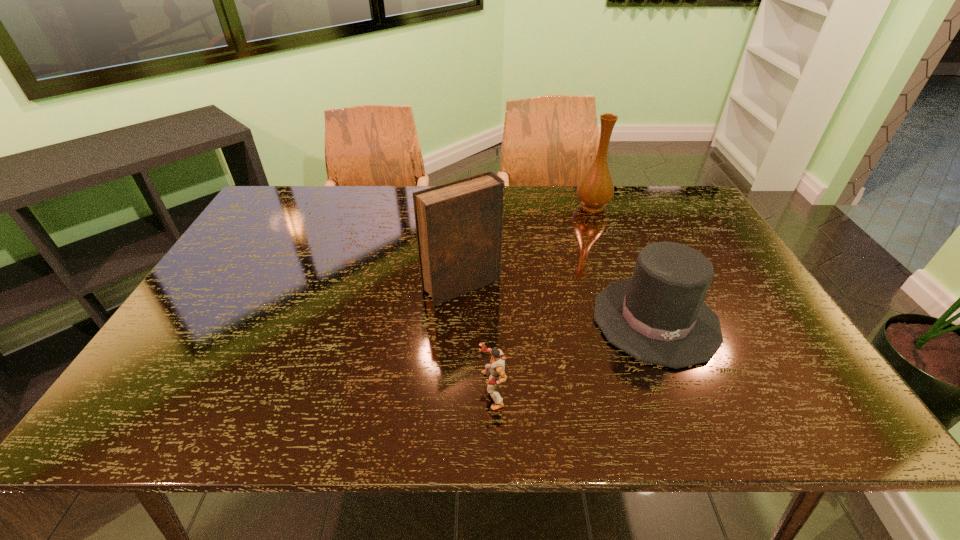
Where is `free space located 0.130m on the front-facing side of the puncher`? free space located 0.130m on the front-facing side of the puncher is located at coordinates (418, 390).

I want to click on object positioned at the far edge, so click(595, 190).

This screenshot has height=540, width=960. What are the coordinates of `object present at the near edge` in the screenshot? It's located at (495, 370).

Where is `object that is at the right edge`? This screenshot has height=540, width=960. object that is at the right edge is located at coordinates (658, 316).

This screenshot has height=540, width=960. In the image, there is a desktop. In order to click on vacant region at the far edge in this screenshot , I will do `click(542, 206)`.

I want to click on free space at the near edge of the desktop, so click(x=459, y=404).

Find the location of `free space at the right edge`. free space at the right edge is located at coordinates (697, 228).

The width and height of the screenshot is (960, 540). I want to click on blank space at the near left corner of the desktop, so coord(186,396).

In the image, there is a desktop. What are the coordinates of `free space at the far right corner` in the screenshot? It's located at (651, 199).

I want to click on vacant space that is in between the farthest object and the shortest object, so click(542, 298).